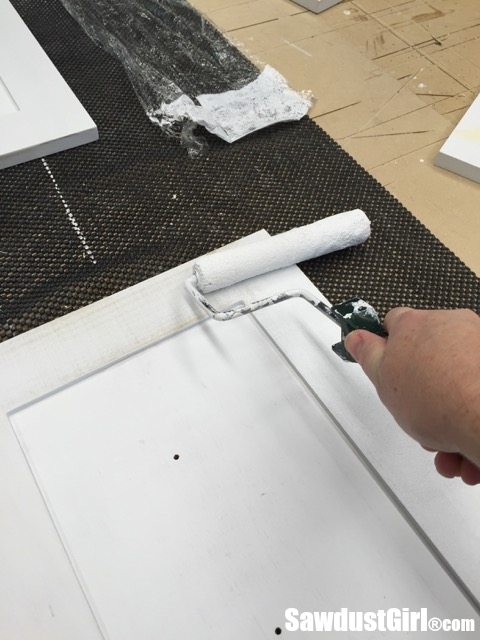
In order to click on surface door is resting on in this screenshot , I will do `click(170, 192)`.